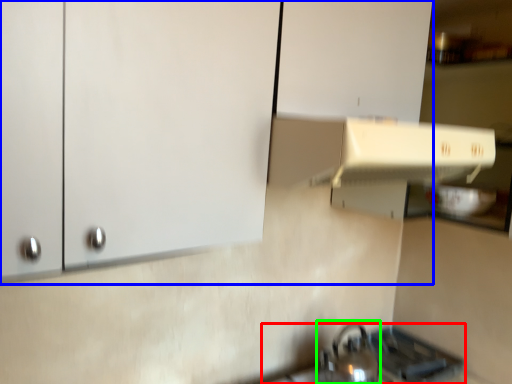
Question: Considering the real-world distances, which object is closest to gas stove (highlighted by a red box)? cabinetry (highlighted by a blue box) or tea pot (highlighted by a green box).

Choices:
 (A) cabinetry
 (B) tea pot

Answer: (B)